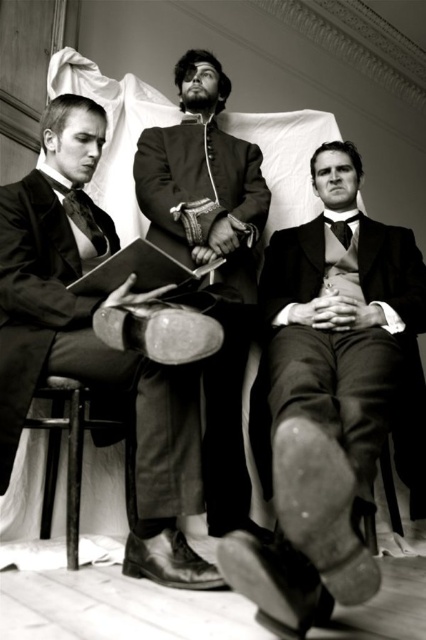
You are an observer in the scene. You see the smooth black suit at center and the smooth black fabric suit at center. Which one is closer to the ground?

The smooth black suit at center is closer to the ground because it is below the smooth black fabric suit at center.